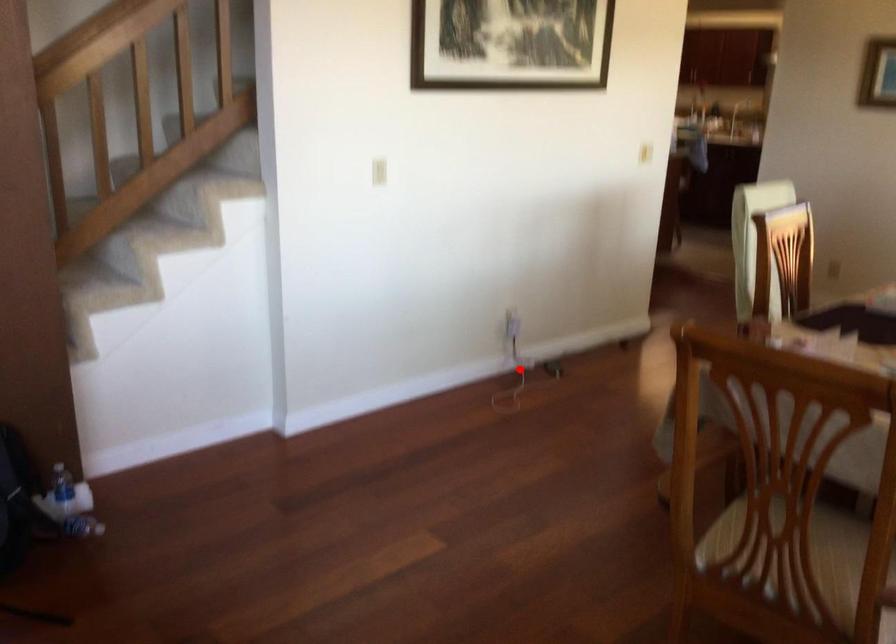
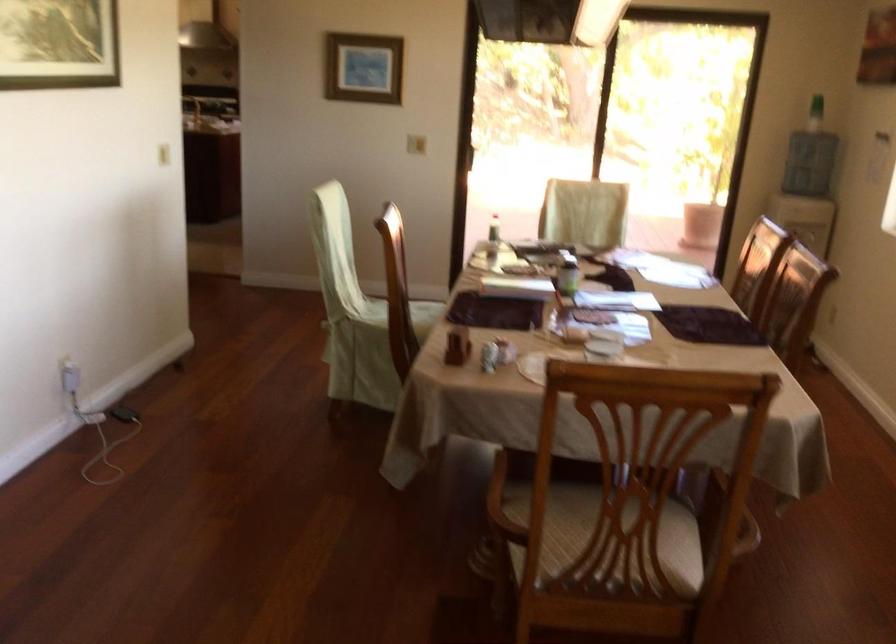
Locate, in the second image, the point that corresponds to the highlighted location in the first image.

(97, 424)